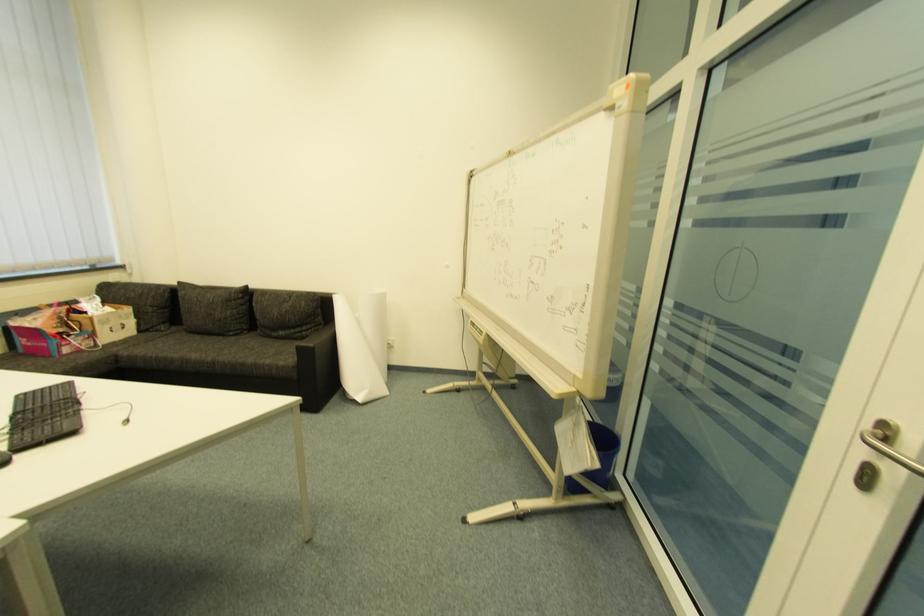
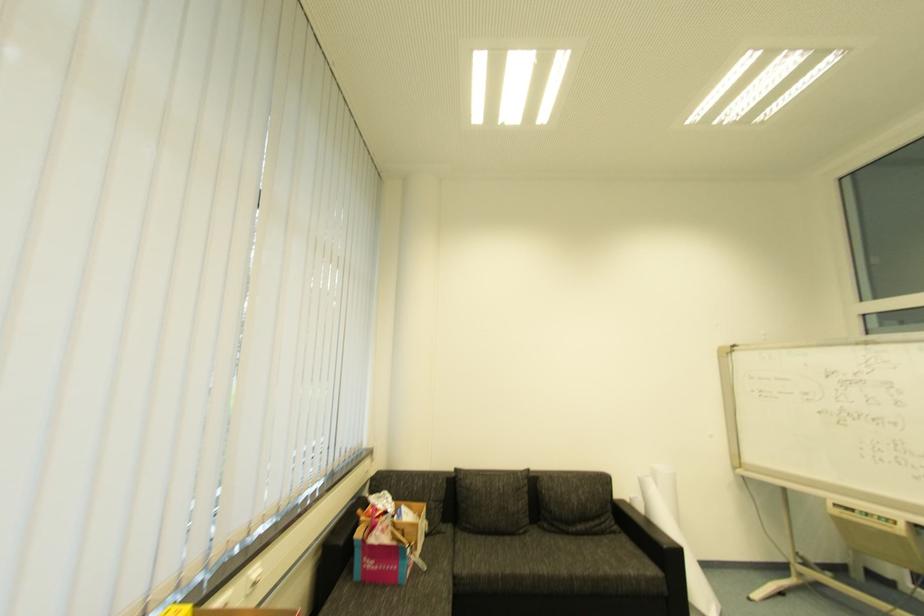
Question: The images are taken continuously from a first-person perspective. In which direction are you moving?

Choices:
 (A) Left
 (B) Right
 (C) Forward
 (D) Backward

Answer: (A)